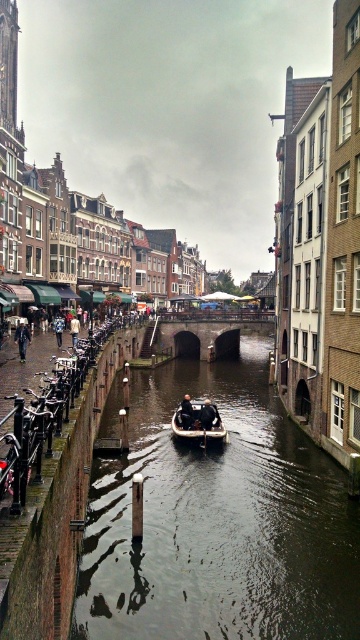
Question: Which object is farther from the camera taking this photo?

Choices:
 (A) dark brown leather jacket at lower left
 (B) dark blue jeans at left
 (C) white plastic boat at center

Answer: (A)

Question: Can you confirm if dark water at center is bigger than blue denim jacket at left?

Choices:
 (A) no
 (B) yes

Answer: (B)

Question: Is dark water at center wider than white plastic boat at center?

Choices:
 (A) no
 (B) yes

Answer: (B)

Question: Is white plastic boat at center positioned before dark brown leather jacket at lower left?

Choices:
 (A) yes
 (B) no

Answer: (A)

Question: Which object appears farthest from the camera in this image?

Choices:
 (A) dark water at center
 (B) dark brown leather jacket at lower left
 (C) dark brown leather jacket at center
 (D) white plastic boat at center

Answer: (B)

Question: Estimate the real-world distances between objects in this image. Which object is farther from the dark blue jeans at left?

Choices:
 (A) dark blue fabric jacket at center
 (B) dark water at center

Answer: (B)